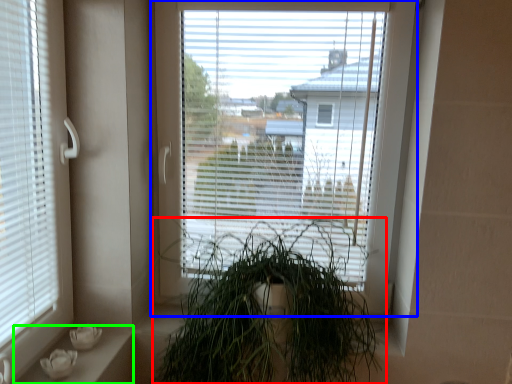
Question: Estimate the real-world distances between objects in this image. Which object is closer to houseplant (highlighted by a red box), window (highlighted by a blue box) or window sill (highlighted by a green box)?

Choices:
 (A) window
 (B) window sill

Answer: (A)